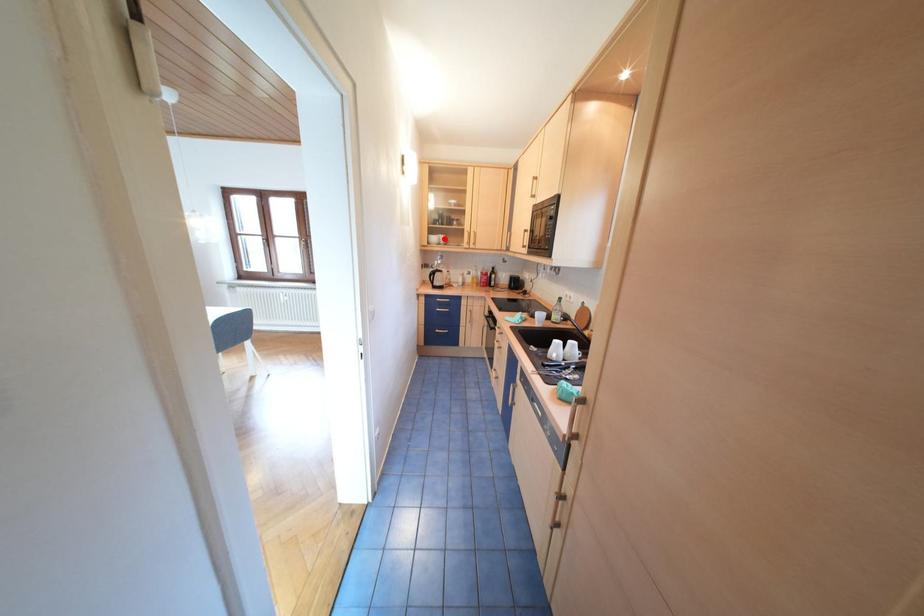
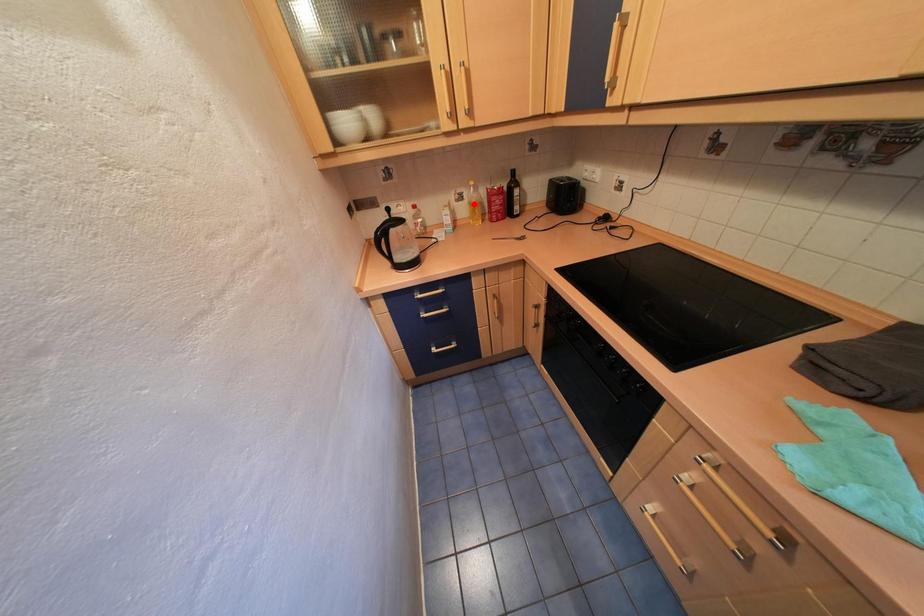
I am providing you with two images of the same scene from different viewpoints. A red point is marked on the first image and another point is marked on the second image. Is the marked point in image1 the same physical position as the marked point in image2?

No